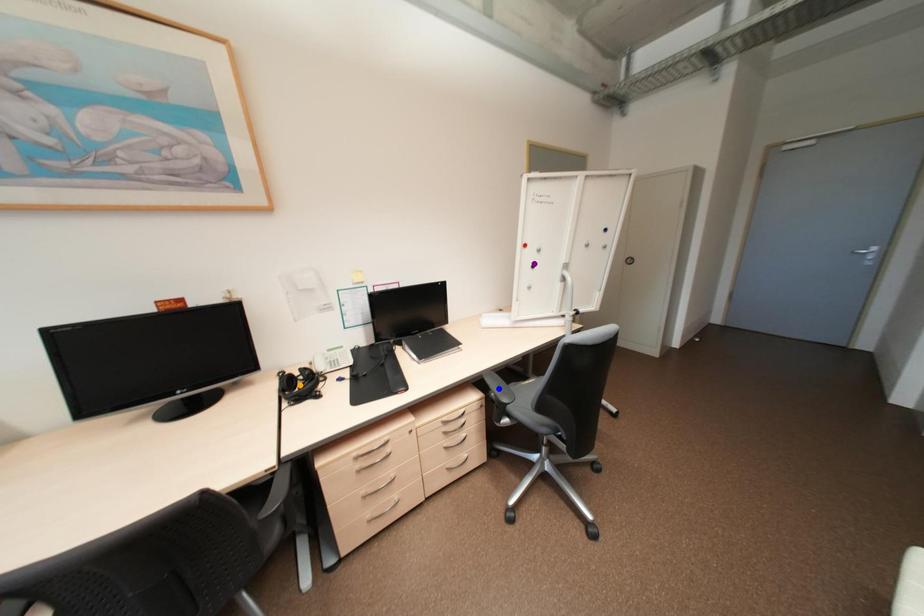
Order these from farthest to nearest:
A) orange point
B) blue point
C) purple point

purple point < orange point < blue point